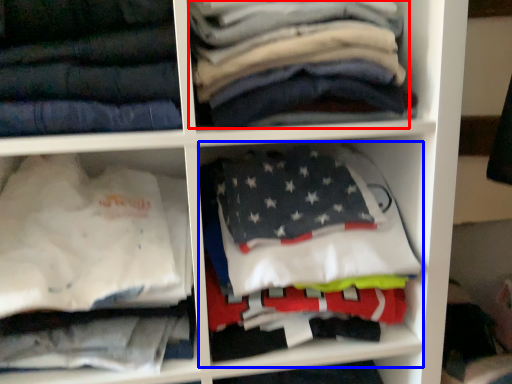
Question: Which of the following is the farthest to the observer, clothing (highlighted by a red box) or cabinet (highlighted by a blue box)?

Choices:
 (A) clothing
 (B) cabinet

Answer: (B)